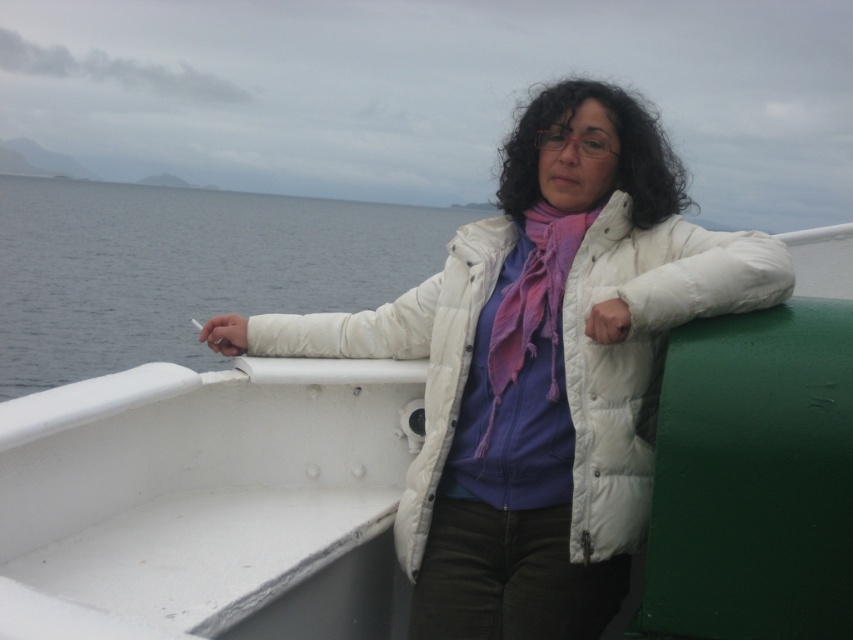
Question: Can you confirm if blue water at left is smaller than matte purple scarf at center?

Choices:
 (A) yes
 (B) no

Answer: (B)

Question: Can you confirm if white puffy jacket at center is positioned to the left of matte purple scarf at center?

Choices:
 (A) no
 (B) yes

Answer: (B)

Question: Which point is farther to the camera?

Choices:
 (A) (689, 256)
 (B) (180, 332)

Answer: (B)

Question: Among these points, which one is farthest from the camera?

Choices:
 (A) (59, 308)
 (B) (548, 364)

Answer: (A)

Question: Which object is farther from the camera taking this photo?

Choices:
 (A) matte purple scarf at center
 (B) blue water at left

Answer: (B)

Question: Can you confirm if blue water at left is smaller than matte purple scarf at center?

Choices:
 (A) yes
 (B) no

Answer: (B)